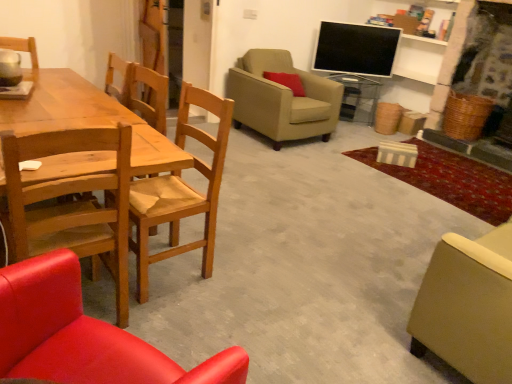
Question: Can you confirm if beige fabric armchair at center, acting as the 1th chair starting from the back, is positioned to the right of wooden chair at left, the fourth chair viewed from the back?

Choices:
 (A) no
 (B) yes

Answer: (B)

Question: Does beige fabric armchair at center, which is counted as the 5th chair, starting from the front, have a greater width compared to wooden chair at left, the fourth chair viewed from the back?

Choices:
 (A) yes
 (B) no

Answer: (A)

Question: From a real-world perspective, is beige fabric armchair at center, acting as the 1th chair starting from the back, physically above wooden chair at left, the fourth chair viewed from the back?

Choices:
 (A) yes
 (B) no

Answer: (B)

Question: Can you confirm if beige fabric armchair at center, which is counted as the 5th chair, starting from the front, is taller than wooden chair at left, the fourth chair viewed from the back?

Choices:
 (A) yes
 (B) no

Answer: (B)

Question: From a real-world perspective, does beige fabric armchair at center, which is counted as the 5th chair, starting from the front, sit lower than wooden chair at left, the fourth chair viewed from the back?

Choices:
 (A) yes
 (B) no

Answer: (A)

Question: From the image's perspective, is beige fabric armchair at center, acting as the 1th chair starting from the back, over wooden chair at left, the second chair viewed from the front?

Choices:
 (A) yes
 (B) no

Answer: (A)

Question: Could wooden chair at left, the second chair viewed from the front, be considered to be inside wooden chair at left, which is counted as the fourth chair, starting from the front?

Choices:
 (A) yes
 (B) no

Answer: (B)

Question: Is wooden chair at left, which is counted as the fourth chair, starting from the front, to the left of wooden chair at left, the second chair viewed from the front, from the viewer's perspective?

Choices:
 (A) yes
 (B) no

Answer: (B)

Question: Are wooden chair at left, which is counted as the fourth chair, starting from the front, and wooden chair at left, the fourth chair viewed from the back, making contact?

Choices:
 (A) no
 (B) yes

Answer: (A)

Question: Does wooden chair at left, which is counted as the fourth chair, starting from the front, lie in front of wooden chair at left, the second chair viewed from the front?

Choices:
 (A) yes
 (B) no

Answer: (B)

Question: Is wooden chair at left, which is counted as the fourth chair, starting from the front, taller than wooden chair at left, the fourth chair viewed from the back?

Choices:
 (A) yes
 (B) no

Answer: (B)

Question: Does wooden chair at left, which is counted as the fourth chair, starting from the front, have a smaller size compared to matte beige armchair at lower right, the third chair viewed from the back?

Choices:
 (A) yes
 (B) no

Answer: (A)